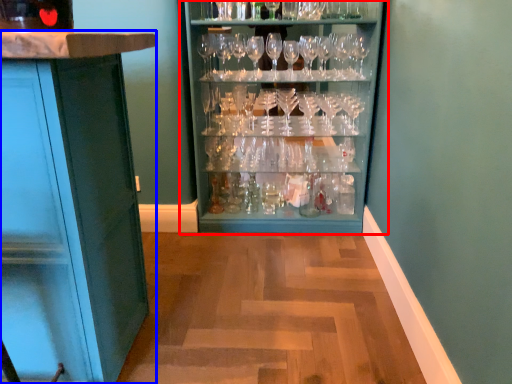
Question: Which of the following is the farthest to the observer, cupboard (highlighted by a red box) or cabinetry (highlighted by a blue box)?

Choices:
 (A) cupboard
 (B) cabinetry

Answer: (A)